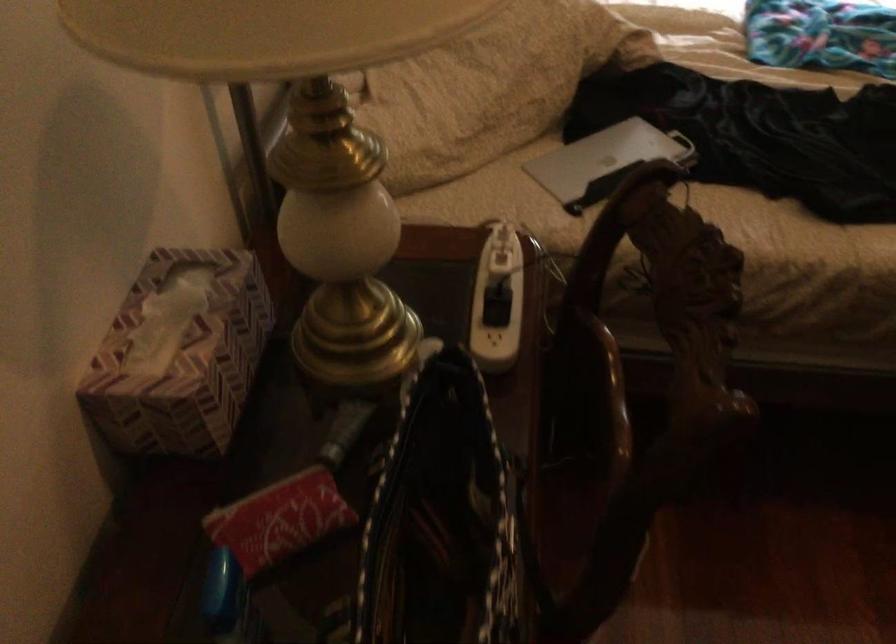
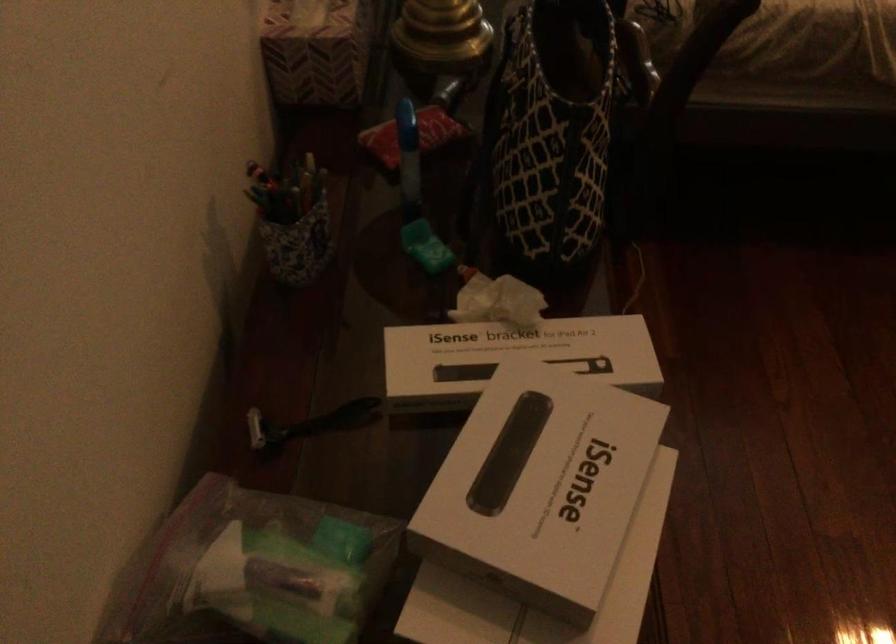
The images are taken continuously from a first-person perspective. In which direction are you moving?

The movement direction of the cameraman is left, backward.